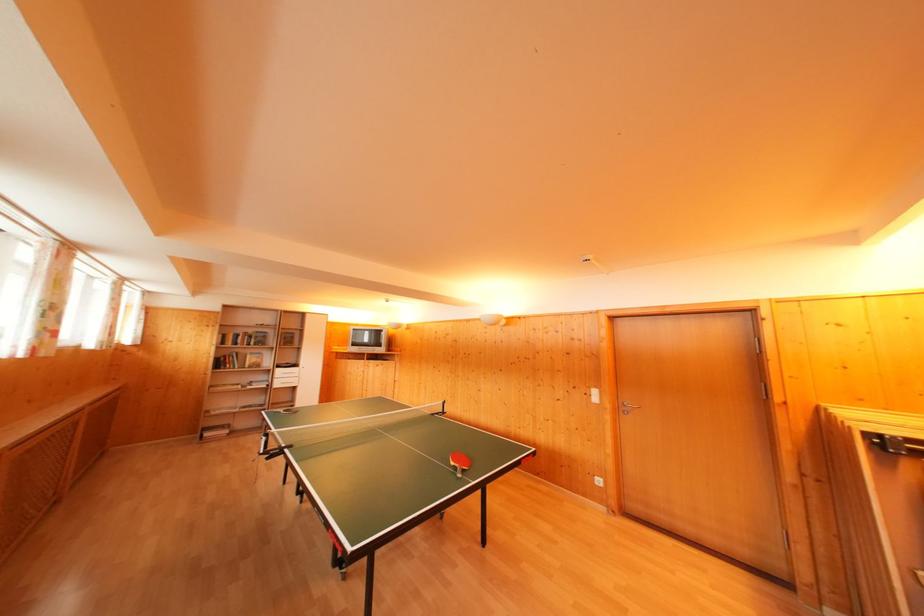
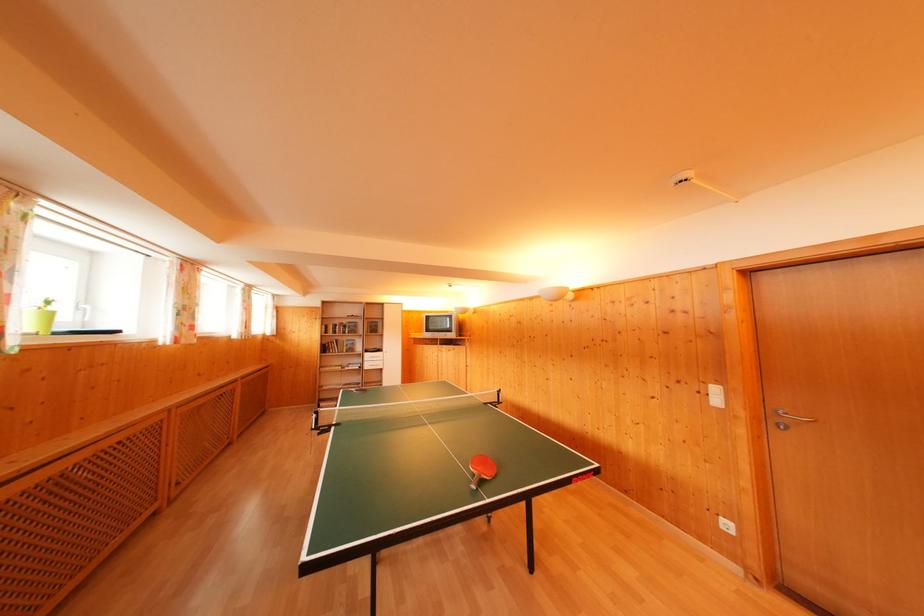
The point at (459, 474) is marked in the first image. Where is the corresponding point in the second image?

(478, 482)